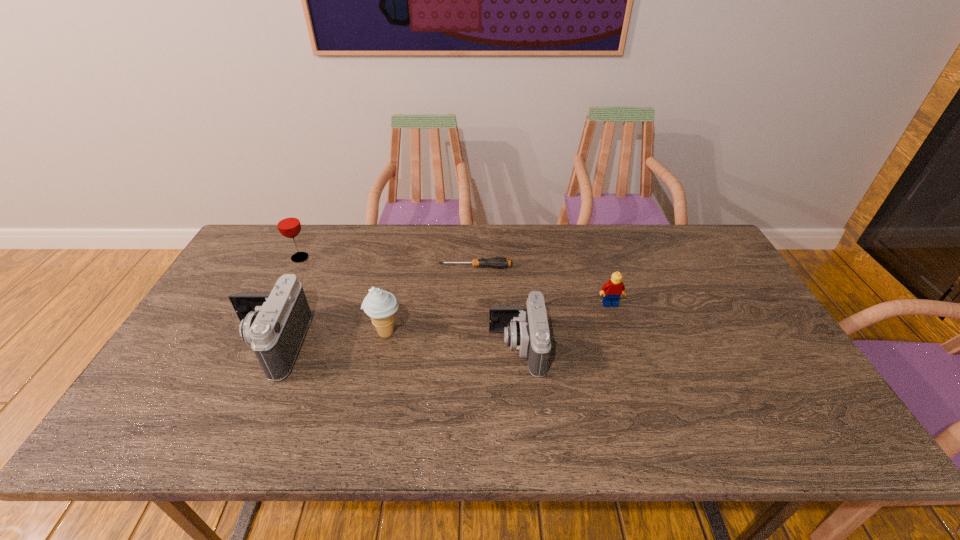
Where is `vacant point at the near edge`? vacant point at the near edge is located at coordinates (493, 377).

In the image, there is a desktop. Identify the location of vacant space at the left edge. This screenshot has width=960, height=540. (224, 319).

This screenshot has width=960, height=540. I want to click on vacant space at the right edge, so click(748, 315).

Locate an element on the screen. vacant space at the near left corner of the desktop is located at coordinates (178, 380).

Locate an element on the screen. This screenshot has width=960, height=540. vacant space at the near right corner of the desktop is located at coordinates click(x=781, y=379).

Image resolution: width=960 pixels, height=540 pixels. Identify the location of free space between the fourth nearest object and the left camera. (440, 325).

Where is `vacant area between the taller camera and the third object from left to right`? This screenshot has width=960, height=540. vacant area between the taller camera and the third object from left to right is located at coordinates (327, 339).

The height and width of the screenshot is (540, 960). Find the location of `free spot between the third object from left to right and the taller camera`. free spot between the third object from left to right and the taller camera is located at coordinates (327, 339).

The height and width of the screenshot is (540, 960). I want to click on free space between the glass and the icecream, so click(343, 295).

At what (x,y) coordinates should I click in order to perform the action: click on free area in between the taller camera and the third farthest object. Please return your answer as a coordinate pair (x, y). Image resolution: width=960 pixels, height=540 pixels. Looking at the image, I should click on (440, 325).